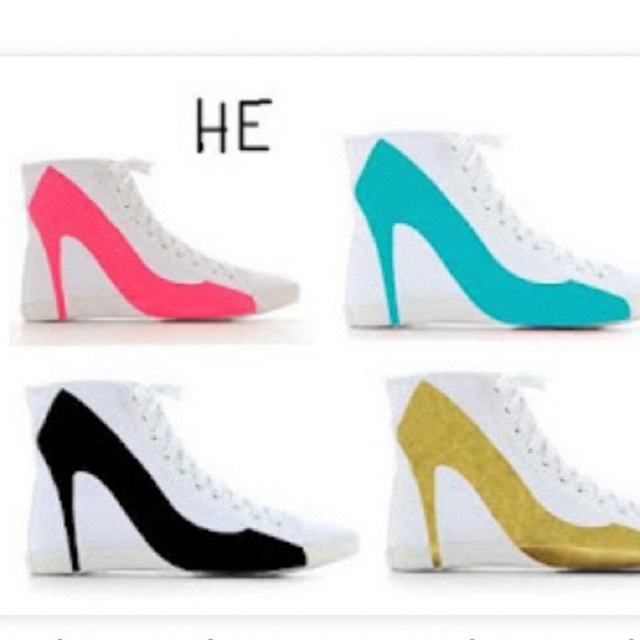
In the scene shown: You are a customer trying to determine which point is closer to you when looking at the four high heeled shoes arranged in a 2x2 grid. The points are labeled as point (381, 140) and point (410, 481). Which point is closer to you?

Point (381, 140) is closer to you than point (410, 481).

You are looking at the arrangement of the four high heeled shoes in the image. There are two points marked on the image, point A at coordinates point [106,566] and point B at coordinates point [497,497]. Which point is closer to you?

Point [106,566] is closer to the viewer than point [497,497].